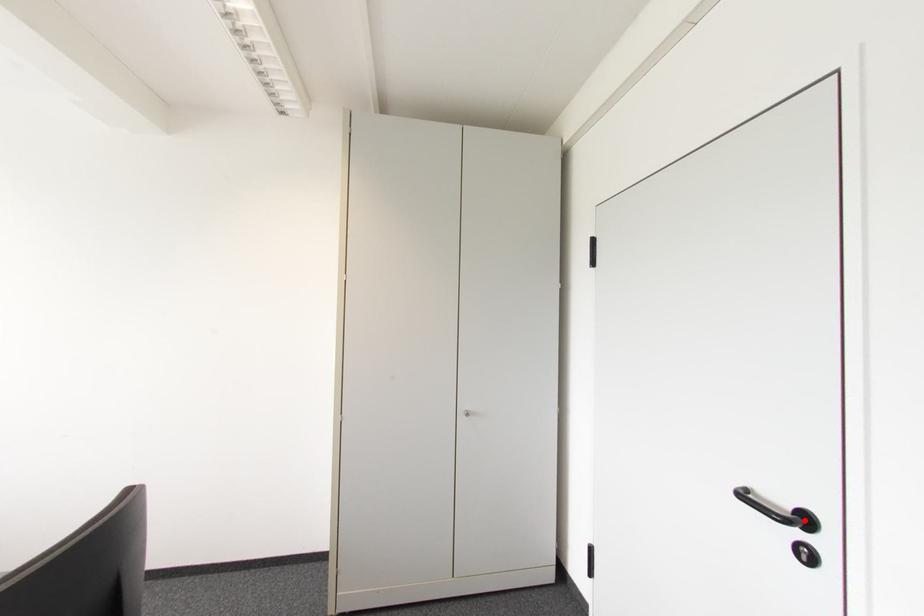
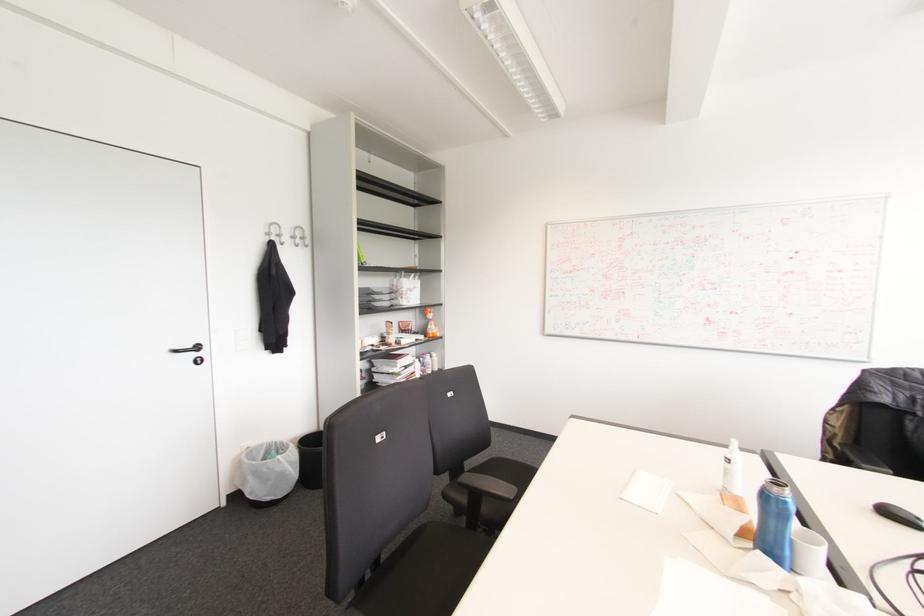
In the second image, find the point that corresponds to the highlighted location in the first image.

(197, 347)